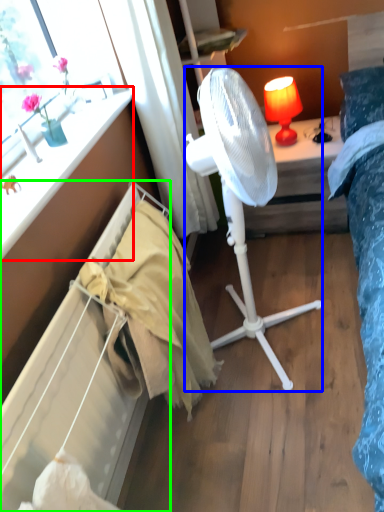
Question: Based on their relative distances, which object is nearer to window sill (highlighted by a red box)? Choose from mechanical fan (highlighted by a blue box) and radiator (highlighted by a green box).

Choices:
 (A) mechanical fan
 (B) radiator

Answer: (B)